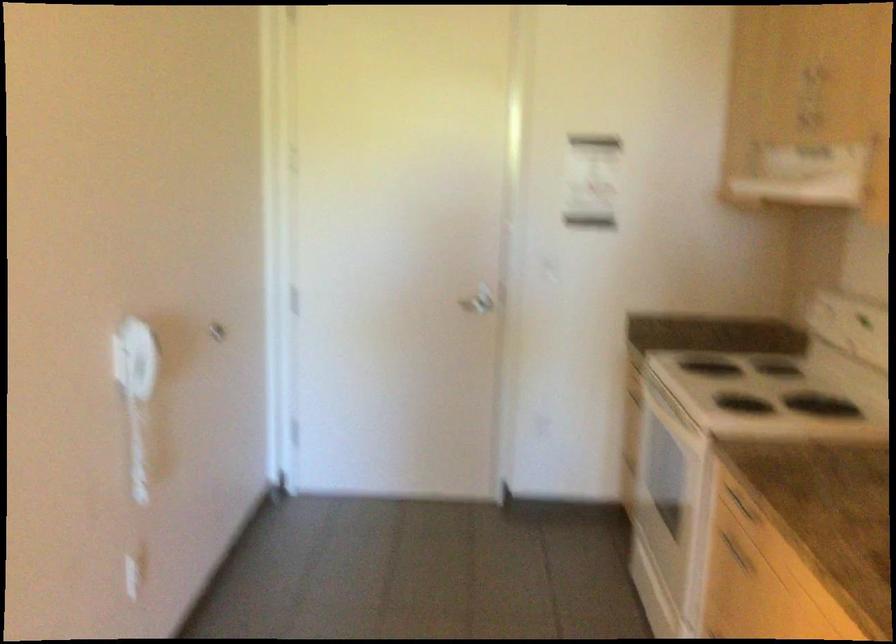
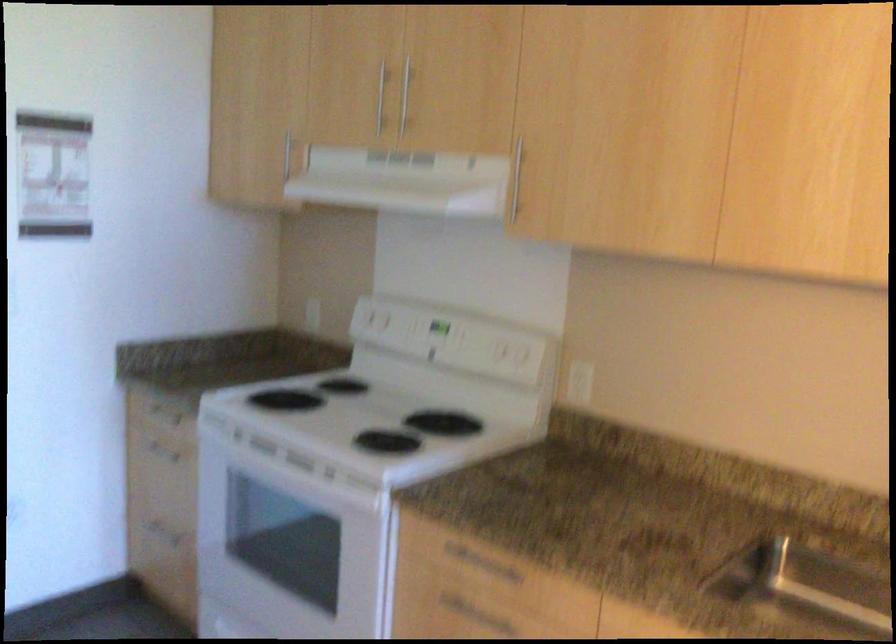
The point at (x=759, y=389) is marked in the first image. Where is the corresponding point in the second image?

(367, 415)